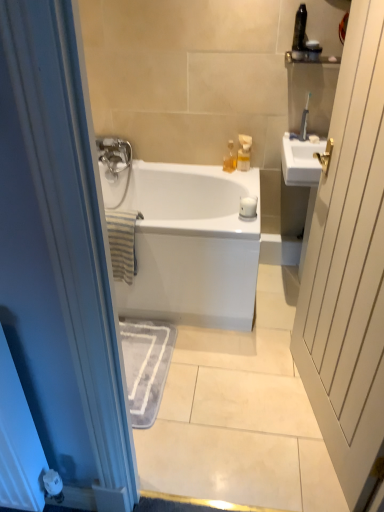
This screenshot has height=512, width=384. I want to click on translucent plastic soap dispenser at upper center, which ranks as the 4th toiletry in right-to-left order, so (x=244, y=152).

Locate an element on the screen. This screenshot has height=512, width=384. white glossy bathtub at center is located at coordinates coord(184,240).

In order to click on translucent plastic bottle at upper center, which is the 5th toiletry from right to left in this screenshot , I will do `click(230, 158)`.

At what (x,y) coordinates should I click in order to perform the action: click on translucent plastic container at upper right, which appears as the 2th toiletry when viewed from the right. Please return your answer as a coordinate pair (x, y). Image resolution: width=384 pixels, height=512 pixels. Looking at the image, I should click on (313, 50).

Are white glossy bathtub at center and white wood door at right located far from each other?

No, white glossy bathtub at center is in close proximity to white wood door at right.

Which object is thinner, white glossy bathtub at center or white wood door at right?

Thinner between the two is white wood door at right.

From the image's perspective, which is below, white glossy bathtub at center or white wood door at right?

white wood door at right is shown below in the image.

Who is bigger, white glossy bathtub at center or white wood door at right?

Bigger between the two is white glossy bathtub at center.

Considering the sizes of objects translucent plastic soap dispenser at upper center, acting as the second toiletry starting from the left, and white glossy bathtub at center in the image provided, who is thinner, translucent plastic soap dispenser at upper center, acting as the second toiletry starting from the left, or white glossy bathtub at center?

Thinner between the two is translucent plastic soap dispenser at upper center, acting as the second toiletry starting from the left.

Is translucent plastic soap dispenser at upper center, which ranks as the 4th toiletry in right-to-left order, oriented away from white glossy bathtub at center?

translucent plastic soap dispenser at upper center, which ranks as the 4th toiletry in right-to-left order, does not have its back to white glossy bathtub at center.

Considering the relative sizes of translucent plastic soap dispenser at upper center, which ranks as the 4th toiletry in right-to-left order, and white glossy bathtub at center in the image provided, is translucent plastic soap dispenser at upper center, which ranks as the 4th toiletry in right-to-left order, shorter than white glossy bathtub at center?

Correct, translucent plastic soap dispenser at upper center, which ranks as the 4th toiletry in right-to-left order, is not as tall as white glossy bathtub at center.

Is black plastic toothbrush at upper right, the 3th toiletry in the left-to-right sequence, looking in the opposite direction of translucent plastic container at upper right, which appears as the 2th toiletry when viewed from the right?

No, translucent plastic container at upper right, which appears as the 2th toiletry when viewed from the right, is not at the back of black plastic toothbrush at upper right, the 3th toiletry in the left-to-right sequence.

Considering the positions of point (302, 20) and point (308, 52), is point (302, 20) closer or farther from the camera than point (308, 52)?

Point (302, 20).

Consider the image. From a real-world perspective, who is located higher, black plastic toothbrush at upper right, the 3th toiletry in the left-to-right sequence, or translucent plastic container at upper right, arranged as the fourth toiletry when viewed from the left?

From a 3D spatial view, black plastic toothbrush at upper right, the 3th toiletry in the left-to-right sequence, is above.

Considering the sizes of objects translucent plastic soap dispenser at upper center, which ranks as the 4th toiletry in right-to-left order, and black plastic toothbrush at upper right, the 3th toiletry in the left-to-right sequence, in the image provided, who is shorter, translucent plastic soap dispenser at upper center, which ranks as the 4th toiletry in right-to-left order, or black plastic toothbrush at upper right, the 3th toiletry in the left-to-right sequence,?

With less height is translucent plastic soap dispenser at upper center, which ranks as the 4th toiletry in right-to-left order.

From a real-world perspective, which is physically below, translucent plastic soap dispenser at upper center, acting as the second toiletry starting from the left, or black plastic toothbrush at upper right, the 3th toiletry in the left-to-right sequence?

translucent plastic soap dispenser at upper center, acting as the second toiletry starting from the left, is physically lower.

Looking at this image, considering the relative sizes of translucent plastic soap dispenser at upper center, acting as the second toiletry starting from the left, and black plastic toothbrush at upper right, arranged as the 3th toiletry when viewed from the right, in the image provided, is translucent plastic soap dispenser at upper center, acting as the second toiletry starting from the left, smaller than black plastic toothbrush at upper right, arranged as the 3th toiletry when viewed from the right,?

Incorrect, translucent plastic soap dispenser at upper center, acting as the second toiletry starting from the left, is not smaller in size than black plastic toothbrush at upper right, arranged as the 3th toiletry when viewed from the right.

Considering the relative positions of white wood door at right and black plastic toothbrush at upper right, the 3th toiletry in the left-to-right sequence, in the image provided, is white wood door at right behind black plastic toothbrush at upper right, the 3th toiletry in the left-to-right sequence,?

A: No, it is in front of black plastic toothbrush at upper right, the 3th toiletry in the left-to-right sequence.

From their relative heights in the image, would you say white wood door at right is taller or shorter than black plastic toothbrush at upper right, arranged as the 3th toiletry when viewed from the right?

Considering their sizes, white wood door at right has more height than black plastic toothbrush at upper right, arranged as the 3th toiletry when viewed from the right.

Does white wood door at right have a greater width compared to black plastic toothbrush at upper right, arranged as the 3th toiletry when viewed from the right?

Yes.

What's the angular difference between white wood door at right and black plastic toothbrush at upper right, the 3th toiletry in the left-to-right sequence,'s facing directions?

The angle between the facing direction of white wood door at right and the facing direction of black plastic toothbrush at upper right, the 3th toiletry in the left-to-right sequence, is 78 degrees.

Starting from the translucent plastic bottle at upper center, which is the 5th toiletry from right to left, which toiletry is the 2nd one in front? Please provide its 2D coordinates.

[(304, 120)]

Is metallic gray toothbrush at upper right, which is the 1th toiletry from right to left, to the right of translucent plastic bottle at upper center, which is the 1th toiletry in left-to-right order, from the viewer's perspective?

Yes.

From a real-world perspective, is metallic gray toothbrush at upper right, which is the 1th toiletry from right to left, above or below translucent plastic bottle at upper center, which is the 1th toiletry in left-to-right order?

metallic gray toothbrush at upper right, which is the 1th toiletry from right to left, is situated higher than translucent plastic bottle at upper center, which is the 1th toiletry in left-to-right order, in the real world.

Can you tell me how much metallic gray toothbrush at upper right, which is the fifth toiletry from left to right, and translucent plastic bottle at upper center, which is the 5th toiletry from right to left, differ in facing direction?

metallic gray toothbrush at upper right, which is the fifth toiletry from left to right, and translucent plastic bottle at upper center, which is the 5th toiletry from right to left, are facing 81.3 degrees away from each other.

Which object is more forward, white wood door at right or white glossy bathtub at center?

white wood door at right is more forward.

From a real-world perspective, is white wood door at right located higher than white glossy bathtub at center?

Yes.

Is white wood door at right outside of white glossy bathtub at center?

white wood door at right is positioned outside white glossy bathtub at center.

Is point (333, 409) more distant than point (232, 285)?

No, (333, 409) is in front of (232, 285).

Where is `door above the white glossy bathtub at center (from a real-world perspective)`? Image resolution: width=384 pixels, height=512 pixels. door above the white glossy bathtub at center (from a real-world perspective) is located at coordinates tap(349, 267).

The width and height of the screenshot is (384, 512). Identify the location of bathtub below the translucent plastic soap dispenser at upper center, which ranks as the 4th toiletry in right-to-left order (from a real-world perspective). (184, 240).

Which object lies nearer to the anchor point white wood door at right, black plastic toothbrush at upper right, arranged as the 3th toiletry when viewed from the right, or metallic gray toothbrush at upper right, which is the fifth toiletry from left to right?

The object closer to white wood door at right is metallic gray toothbrush at upper right, which is the fifth toiletry from left to right.

From the image, which object appears to be nearer to translucent plastic bottle at upper center, which is the 5th toiletry from right to left, translucent plastic container at upper right, which appears as the 2th toiletry when viewed from the right, or white glossy bathtub at center?

white glossy bathtub at center lies closer to translucent plastic bottle at upper center, which is the 5th toiletry from right to left, than the other object.

From the image, which object appears to be farther from metallic gray toothbrush at upper right, which is the fifth toiletry from left to right, white glossy bathtub at center or translucent plastic soap dispenser at upper center, acting as the second toiletry starting from the left?

Among the two, white glossy bathtub at center is located further to metallic gray toothbrush at upper right, which is the fifth toiletry from left to right.

Looking at the image, which one is located closer to metallic gray toothbrush at upper right, which is the fifth toiletry from left to right, translucent plastic container at upper right, which appears as the 2th toiletry when viewed from the right, or white glossy bathtub at center?

translucent plastic container at upper right, which appears as the 2th toiletry when viewed from the right, is positioned closer to the anchor metallic gray toothbrush at upper right, which is the fifth toiletry from left to right.

From the image, which object appears to be nearer to translucent plastic container at upper right, which appears as the 2th toiletry when viewed from the right, black plastic toothbrush at upper right, the 3th toiletry in the left-to-right sequence, or white wood door at right?

black plastic toothbrush at upper right, the 3th toiletry in the left-to-right sequence, lies closer to translucent plastic container at upper right, which appears as the 2th toiletry when viewed from the right, than the other object.

Considering their positions, is black plastic toothbrush at upper right, arranged as the 3th toiletry when viewed from the right, positioned further to white wood door at right than translucent plastic bottle at upper center, which is the 1th toiletry in left-to-right order?

black plastic toothbrush at upper right, arranged as the 3th toiletry when viewed from the right, is further to white wood door at right.

Looking at the image, which one is located further to translucent plastic bottle at upper center, which is the 1th toiletry in left-to-right order, black plastic toothbrush at upper right, the 3th toiletry in the left-to-right sequence, or metallic gray toothbrush at upper right, which is the 1th toiletry from right to left?

black plastic toothbrush at upper right, the 3th toiletry in the left-to-right sequence, is further to translucent plastic bottle at upper center, which is the 1th toiletry in left-to-right order.

Based on their spatial positions, is translucent plastic soap dispenser at upper center, acting as the second toiletry starting from the left, or black plastic toothbrush at upper right, arranged as the 3th toiletry when viewed from the right, closer to translucent plastic container at upper right, which appears as the 2th toiletry when viewed from the right?

Among the two, black plastic toothbrush at upper right, arranged as the 3th toiletry when viewed from the right, is located nearer to translucent plastic container at upper right, which appears as the 2th toiletry when viewed from the right.

You are a GUI agent. You are given a task and a screenshot of the screen. Output one action in this format:
    pyautogui.click(x=<x>, y=<y>)
    Task: Click on the toiletry between black plastic toothbrush at upper right, the 3th toiletry in the left-to-right sequence, and metallic gray toothbrush at upper right, which is the 1th toiletry from right to left, from top to bottom
    Image resolution: width=384 pixels, height=512 pixels.
    Given the screenshot: What is the action you would take?
    pyautogui.click(x=313, y=50)

The height and width of the screenshot is (512, 384). In order to click on bathtub between white wood door at right and translucent plastic container at upper right, arranged as the fourth toiletry when viewed from the left, along the z-axis in this screenshot , I will do `click(184, 240)`.

At what (x,y) coordinates should I click in order to perform the action: click on bathtub between white wood door at right and translucent plastic bottle at upper center, which is the 5th toiletry from right to left, in the front-back direction. Please return your answer as a coordinate pair (x, y). Image resolution: width=384 pixels, height=512 pixels. Looking at the image, I should click on (184, 240).

You are a GUI agent. You are given a task and a screenshot of the screen. Output one action in this format:
    pyautogui.click(x=<x>, y=<y>)
    Task: Click on the bathtub between white wood door at right and metallic gray toothbrush at upper right, which is the fifth toiletry from left to right, along the z-axis
    This screenshot has width=384, height=512.
    Given the screenshot: What is the action you would take?
    pyautogui.click(x=184, y=240)